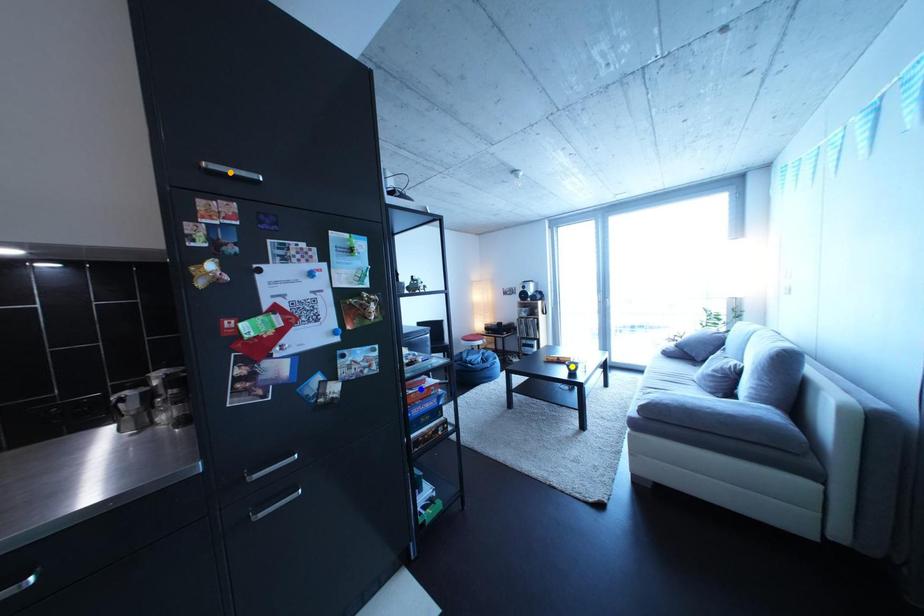
Order these from nearest to farthest:
1. blue point
2. yellow point
3. orange point

yellow point
blue point
orange point